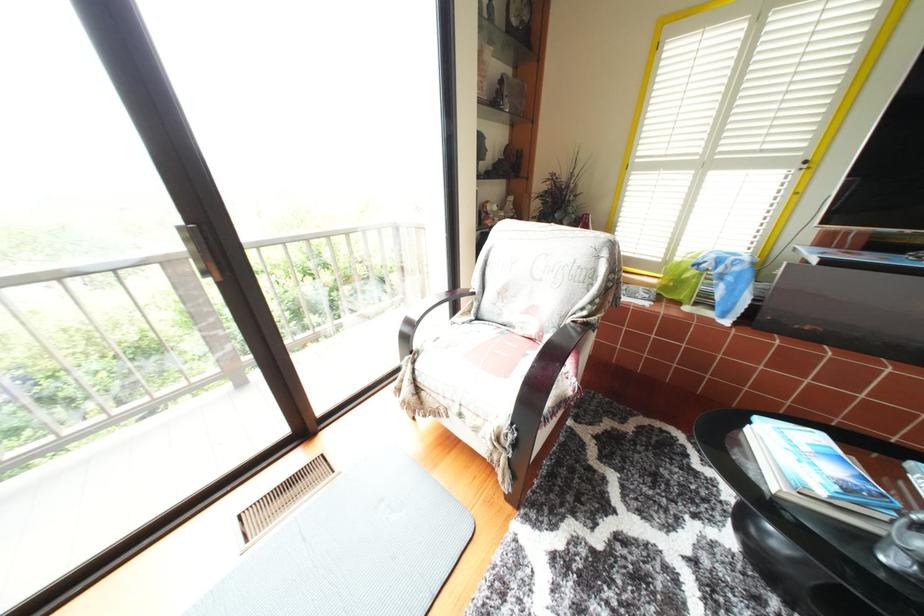
Find where to sit the chair sitting surface. Please return your answer as a coordinate pair (x, y).

(492, 350)